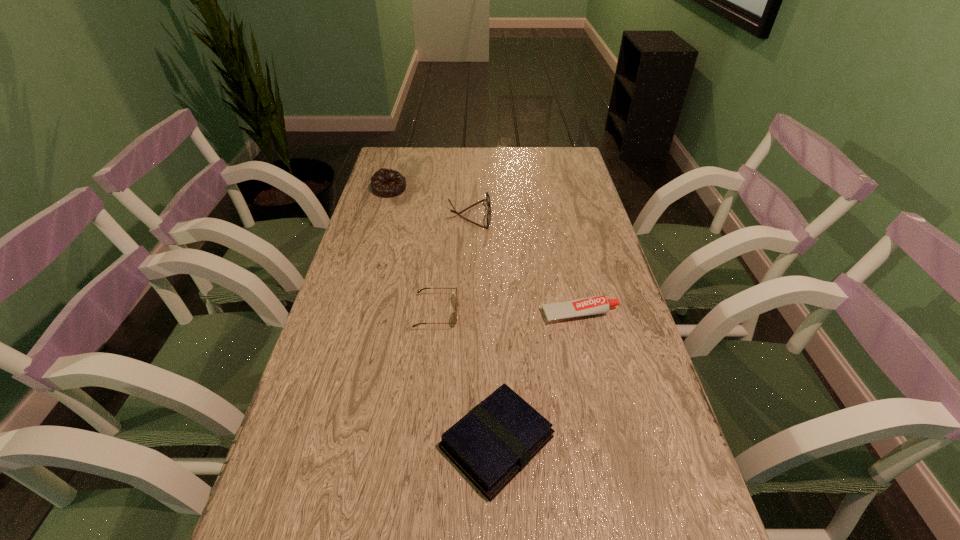
Identify which object is the second nearest to the book. Please provide its 2D coordinates. Your answer should be formatted as a tuple, i.e. [(x, y)], where the tuple contains the x and y coordinates of a point satisfying the conditions above.

[(594, 305)]

Locate an element on the screen. vacant region that satisfies the following two spatial constraints: 1. on the front-facing side of the second farthest object; 2. on the left side of the book is located at coordinates (463, 442).

Locate an element on the screen. vacant space that satisfies the following two spatial constraints: 1. on the front-facing side of the toothpaste; 2. on the right side of the spectacles is located at coordinates (467, 314).

Find the location of a particular element. The height and width of the screenshot is (540, 960). vacant space that satisfies the following two spatial constraints: 1. on the front-facing side of the book; 2. on the right side of the fourth nearest object is located at coordinates (463, 442).

You are a GUI agent. You are given a task and a screenshot of the screen. Output one action in this format:
    pyautogui.click(x=<x>, y=<y>)
    Task: Click on the blank space that satisfies the following two spatial constraints: 1. on the front-facing side of the shortest object; 2. on the right side of the spectacles
    Image resolution: width=960 pixels, height=540 pixels.
    Given the screenshot: What is the action you would take?
    pyautogui.click(x=467, y=314)

The width and height of the screenshot is (960, 540). Find the location of `vacant space that satisfies the following two spatial constraints: 1. on the lenses of the nearest object; 2. on the right side of the sunglasses`. vacant space that satisfies the following two spatial constraints: 1. on the lenses of the nearest object; 2. on the right side of the sunglasses is located at coordinates (424, 442).

At what (x,y) coordinates should I click in order to perform the action: click on vacant space that satisfies the following two spatial constraints: 1. on the front-facing side of the fourth nearest object; 2. on the back side of the nearest object. Please return your answer as a coordinate pair (x, y). The image size is (960, 540). Looking at the image, I should click on (463, 442).